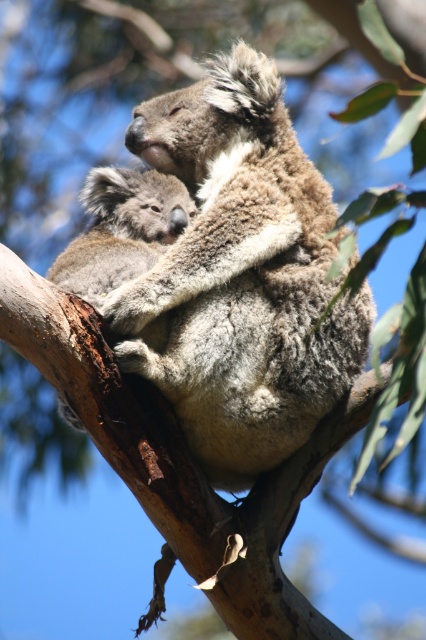
Question: Can you confirm if fuzzy brown koala at center is wider than fuzzy gray koala at center?

Choices:
 (A) yes
 (B) no

Answer: (A)

Question: Is fuzzy brown koala at center to the left of fuzzy gray koala at center from the viewer's perspective?

Choices:
 (A) yes
 (B) no

Answer: (B)

Question: Does fuzzy brown koala at center have a lesser width compared to fuzzy gray koala at center?

Choices:
 (A) yes
 (B) no

Answer: (B)

Question: Among these points, which one is farthest from the camera?

Choices:
 (A) (340, 323)
 (B) (74, 244)

Answer: (B)

Question: Which point is closer to the camera?

Choices:
 (A) fuzzy brown koala at center
 (B) fuzzy gray koala at center

Answer: (A)